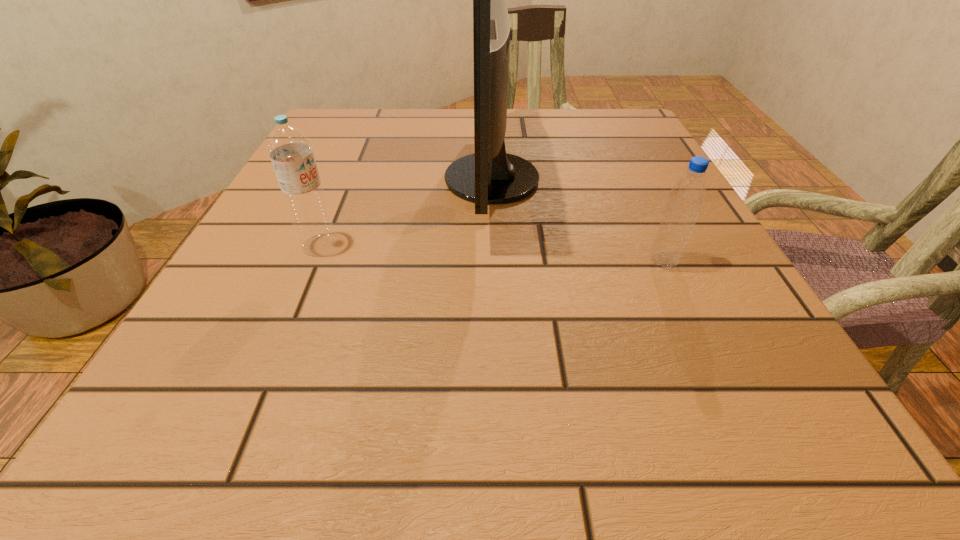
The width and height of the screenshot is (960, 540). I want to click on vacant area located on the front of the shortest object, so click(707, 354).

I want to click on object located at the far edge, so click(489, 176).

In order to click on object that is at the left edge in this screenshot , I will do `click(290, 150)`.

Image resolution: width=960 pixels, height=540 pixels. I want to click on object positioned at the right edge, so click(x=687, y=196).

At what (x,y) coordinates should I click in order to perform the action: click on free space at the far edge of the desktop. Please return your answer as a coordinate pair (x, y). Looking at the image, I should click on (517, 148).

In the image, there is a desktop. Identify the location of vacant space at the right edge. (589, 157).

At what (x,y) coordinates should I click in order to perform the action: click on vacant space at the far left corner of the desktop. Please return your answer as a coordinate pair (x, y). Looking at the image, I should click on tap(362, 124).

Identify the location of blank area at the far right corner. The image size is (960, 540). (612, 151).

Identify the location of vacant region at the near right corner. (758, 429).

At what (x,y) coordinates should I click in order to perform the action: click on vacant space in between the second tallest object and the rightmost object. Please return your answer as a coordinate pair (x, y). The height and width of the screenshot is (540, 960). Looking at the image, I should click on (492, 253).